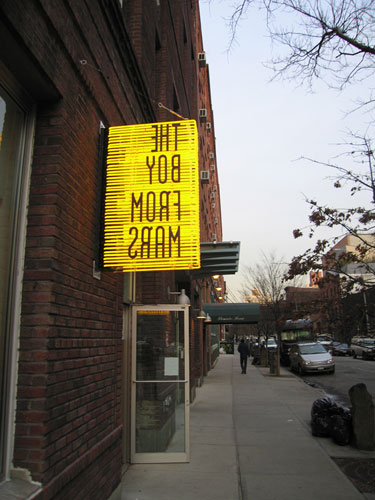
You are a GUI agent. You are given a task and a screenshot of the screen. Output one action in this format:
    pyautogui.click(x=<x>, y=<y>)
    Task: Click on the lamps
    This screenshot has width=375, height=500.
    Given the screenshot: What is the action you would take?
    pyautogui.click(x=184, y=299), pyautogui.click(x=216, y=275), pyautogui.click(x=218, y=292), pyautogui.click(x=219, y=298), pyautogui.click(x=201, y=316), pyautogui.click(x=210, y=319)